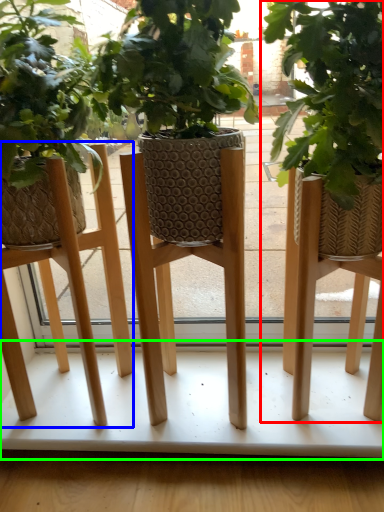
Question: Considering the real-world distances, which object is farthest from houseplant (highlighted by a red box)? stool (highlighted by a blue box) or table (highlighted by a green box)?

Choices:
 (A) stool
 (B) table

Answer: (A)